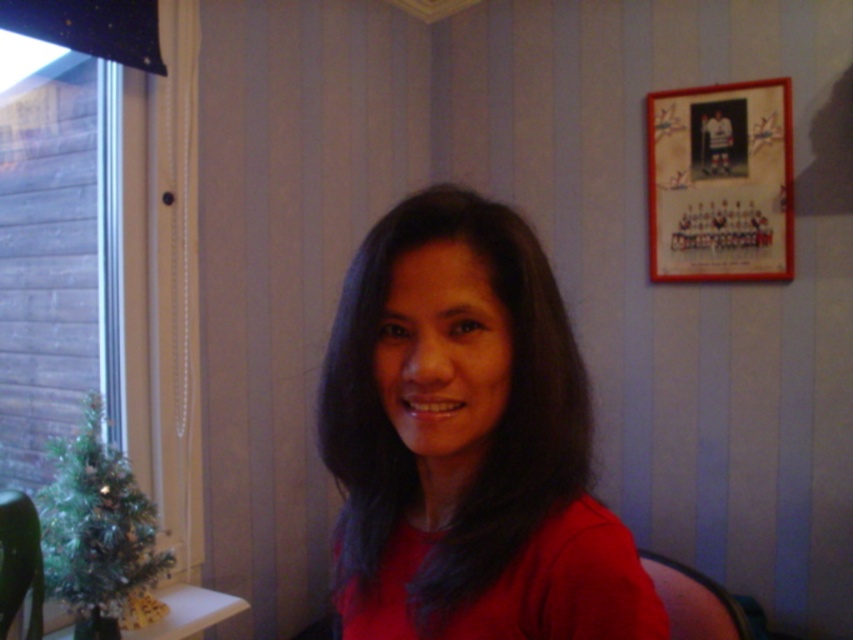
You are planning to hang a picture frame that is 1 meter tall on the wall. You want to place it so that it doesn not cover the clear glass window at left. Given the height of the matte red shirt at center, will the picture frame fit vertically without overlapping the window?

The matte red shirt at center has a lesser height compared to clear glass window at left, so the picture frame that is 1 meter tall can be placed vertically without overlapping the window as the window is taller than the shirt.

You are a delivery robot that is 1 meter wide. You need to move from the entrance to the left side of the room while avoiding obstacles. Is there enough space between the matte red shirt at center and the green glossy table at lower left for you to pass through?

The matte red shirt at center and the green glossy table at lower left are 1.05 meters apart, which is just enough space for the robot to pass through since it is 1 meter wide.